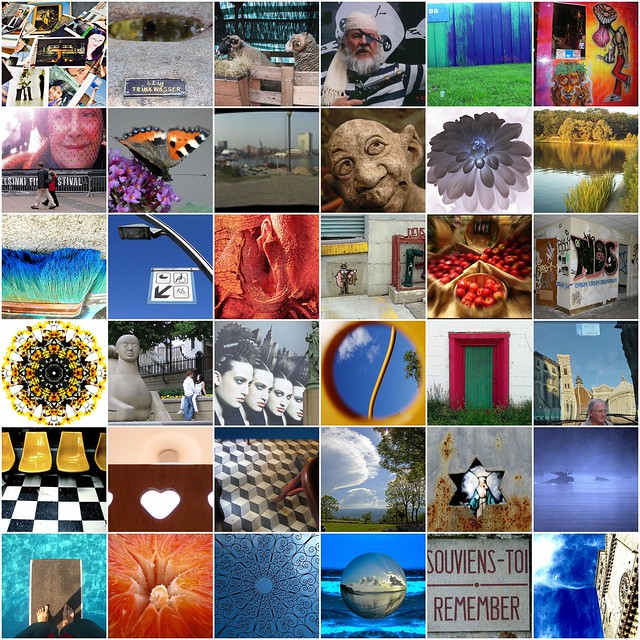
Image resolution: width=640 pixels, height=640 pixels. In order to click on chairs in this screenshot , I will do `click(100, 467)`, `click(76, 461)`, `click(43, 461)`, `click(4, 454)`.